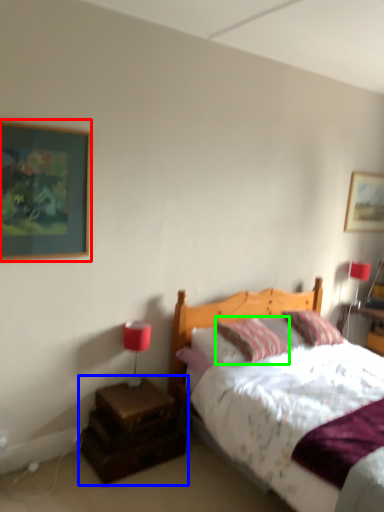
Question: Estimate the real-world distances between objects in this image. Which object is closer to picture frame (highlighted by a red box), nightstand (highlighted by a blue box) or pillow (highlighted by a green box)?

Choices:
 (A) nightstand
 (B) pillow

Answer: (A)